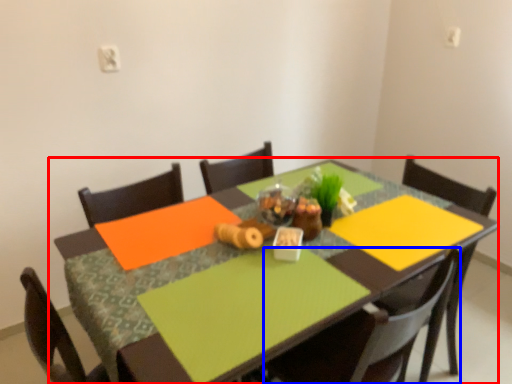
Question: Which of the following is the farthest to the observer, table (highlighted by a red box) or chair (highlighted by a blue box)?

Choices:
 (A) table
 (B) chair

Answer: (B)